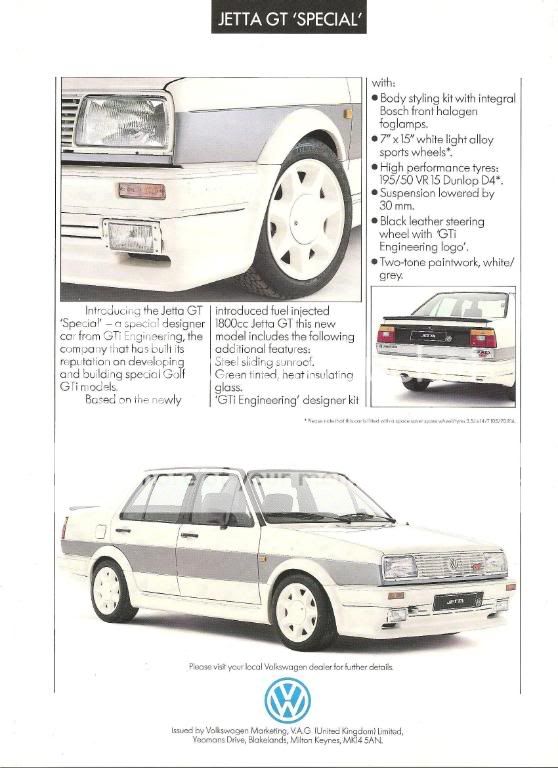
Identify the location of door handle. (192, 535), (124, 530).